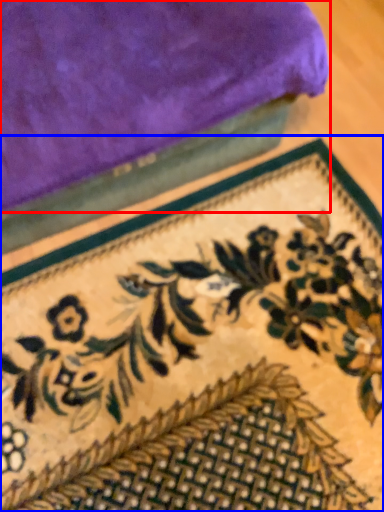
Question: Among these objects, which one is farthest to the camera, towel (highlighted by a red box) or mat (highlighted by a blue box)?

Choices:
 (A) towel
 (B) mat

Answer: (B)